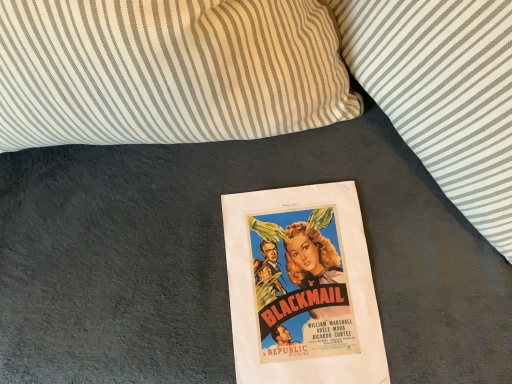
How much space does white striped pillow at upper center, which is the 1th pillow from left to right, occupy vertically?

It is 21.83 inches.

At what (x,y) coordinates should I click in order to perform the action: click on white striped pillow at upper center, the 2th pillow viewed from the right. Please return your answer as a coordinate pair (x, y). Looking at the image, I should click on (167, 71).

Describe the element at coordinates (167, 71) in the screenshot. I see `white striped pillow at upper center, which is the 1th pillow from left to right` at that location.

Describe the element at coordinates (443, 93) in the screenshot. I see `striped fabric pillow at upper center, the 1th pillow from the right` at that location.

Identify the location of striped fabric pillow at upper center, arranged as the 2th pillow when viewed from the left. (443, 93).

Locate an element on the screen. white striped pillow at upper center, the 2th pillow viewed from the right is located at coordinates (167, 71).

Which object is positioned more to the left, striped fabric pillow at upper center, the 1th pillow from the right, or white striped pillow at upper center, the 2th pillow viewed from the right?

From the viewer's perspective, white striped pillow at upper center, the 2th pillow viewed from the right, appears more on the left side.

Between striped fabric pillow at upper center, arranged as the 2th pillow when viewed from the left, and white striped pillow at upper center, which is the 1th pillow from left to right, which one is positioned in front?

striped fabric pillow at upper center, arranged as the 2th pillow when viewed from the left.

Does point (347, 9) appear closer or farther from the camera than point (35, 21)?

Point (347, 9) appears to be farther away from the viewer than point (35, 21).

From the image's perspective, who appears lower, striped fabric pillow at upper center, the 1th pillow from the right, or white striped pillow at upper center, the 2th pillow viewed from the right?

striped fabric pillow at upper center, the 1th pillow from the right.

From a real-world perspective, is striped fabric pillow at upper center, arranged as the 2th pillow when viewed from the left, above or below white striped pillow at upper center, which is the 1th pillow from left to right?

striped fabric pillow at upper center, arranged as the 2th pillow when viewed from the left, is situated higher than white striped pillow at upper center, which is the 1th pillow from left to right, in the real world.

Which object is thinner, striped fabric pillow at upper center, arranged as the 2th pillow when viewed from the left, or white striped pillow at upper center, the 2th pillow viewed from the right?

Thinner between the two is white striped pillow at upper center, the 2th pillow viewed from the right.

Does striped fabric pillow at upper center, the 1th pillow from the right, have a lesser height compared to white striped pillow at upper center, which is the 1th pillow from left to right?

Yes.

Considering the sizes of objects striped fabric pillow at upper center, the 1th pillow from the right, and white striped pillow at upper center, the 2th pillow viewed from the right, in the image provided, who is smaller, striped fabric pillow at upper center, the 1th pillow from the right, or white striped pillow at upper center, the 2th pillow viewed from the right,?

With smaller size is striped fabric pillow at upper center, the 1th pillow from the right.

From the picture: Is striped fabric pillow at upper center, the 1th pillow from the right, inside or outside of white striped pillow at upper center, the 2th pillow viewed from the right?

The correct answer is: outside.

Is there a large distance between striped fabric pillow at upper center, arranged as the 2th pillow when viewed from the left, and white striped pillow at upper center, the 2th pillow viewed from the right?

No, striped fabric pillow at upper center, arranged as the 2th pillow when viewed from the left, is in close proximity to white striped pillow at upper center, the 2th pillow viewed from the right.

Is striped fabric pillow at upper center, arranged as the 2th pillow when viewed from the left, facing towards white striped pillow at upper center, the 2th pillow viewed from the right?

Yes, striped fabric pillow at upper center, arranged as the 2th pillow when viewed from the left, faces towards white striped pillow at upper center, the 2th pillow viewed from the right.

Identify the location of pillow behind the striped fabric pillow at upper center, the 1th pillow from the right. The image size is (512, 384). (167, 71).

Visually, is white striped pillow at upper center, which is the 1th pillow from left to right, positioned to the left or to the right of striped fabric pillow at upper center, arranged as the 2th pillow when viewed from the left?

In the image, white striped pillow at upper center, which is the 1th pillow from left to right, appears on the left side of striped fabric pillow at upper center, arranged as the 2th pillow when viewed from the left.

Which object is further away from the camera taking this photo, white striped pillow at upper center, the 2th pillow viewed from the right, or striped fabric pillow at upper center, arranged as the 2th pillow when viewed from the left?

white striped pillow at upper center, the 2th pillow viewed from the right, is more distant.

Is point (246, 101) positioned behind point (398, 100)?

No, (246, 101) is in front of (398, 100).

From the image's perspective, relative to striped fabric pillow at upper center, arranged as the 2th pillow when viewed from the left, is white striped pillow at upper center, which is the 1th pillow from left to right, above or below?

From the image's perspective, white striped pillow at upper center, which is the 1th pillow from left to right, appears above striped fabric pillow at upper center, arranged as the 2th pillow when viewed from the left.

From a real-world perspective, is white striped pillow at upper center, which is the 1th pillow from left to right, positioned under striped fabric pillow at upper center, the 1th pillow from the right, based on gravity?

Yes, from a real-world perspective, white striped pillow at upper center, which is the 1th pillow from left to right, is below striped fabric pillow at upper center, the 1th pillow from the right.

Which of these two, white striped pillow at upper center, the 2th pillow viewed from the right, or striped fabric pillow at upper center, the 1th pillow from the right, is wider?

With larger width is striped fabric pillow at upper center, the 1th pillow from the right.

Between white striped pillow at upper center, which is the 1th pillow from left to right, and striped fabric pillow at upper center, arranged as the 2th pillow when viewed from the left, which one has more height?

With more height is white striped pillow at upper center, which is the 1th pillow from left to right.

Considering the relative sizes of white striped pillow at upper center, which is the 1th pillow from left to right, and striped fabric pillow at upper center, the 1th pillow from the right, in the image provided, is white striped pillow at upper center, which is the 1th pillow from left to right, bigger than striped fabric pillow at upper center, the 1th pillow from the right,?

Yes, white striped pillow at upper center, which is the 1th pillow from left to right, is bigger than striped fabric pillow at upper center, the 1th pillow from the right.

Is striped fabric pillow at upper center, the 1th pillow from the right, located within white striped pillow at upper center, which is the 1th pillow from left to right?

No, striped fabric pillow at upper center, the 1th pillow from the right, is not a part of white striped pillow at upper center, which is the 1th pillow from left to right.

Consider the image. Is white striped pillow at upper center, the 2th pillow viewed from the right, positioned far away from striped fabric pillow at upper center, arranged as the 2th pillow when viewed from the left?

Actually, white striped pillow at upper center, the 2th pillow viewed from the right, and striped fabric pillow at upper center, arranged as the 2th pillow when viewed from the left, are a little close together.

Is white striped pillow at upper center, which is the 1th pillow from left to right, oriented away from striped fabric pillow at upper center, the 1th pillow from the right?

white striped pillow at upper center, which is the 1th pillow from left to right, does not have its back to striped fabric pillow at upper center, the 1th pillow from the right.

How much distance is there between white striped pillow at upper center, which is the 1th pillow from left to right, and striped fabric pillow at upper center, the 1th pillow from the right?

white striped pillow at upper center, which is the 1th pillow from left to right, is 7.75 inches away from striped fabric pillow at upper center, the 1th pillow from the right.

I want to click on pillow behind the striped fabric pillow at upper center, arranged as the 2th pillow when viewed from the left, so click(167, 71).

Locate an element on the screen. pillow lying on the right of white striped pillow at upper center, the 2th pillow viewed from the right is located at coordinates (443, 93).

This screenshot has width=512, height=384. I want to click on pillow behind the striped fabric pillow at upper center, arranged as the 2th pillow when viewed from the left, so click(x=167, y=71).